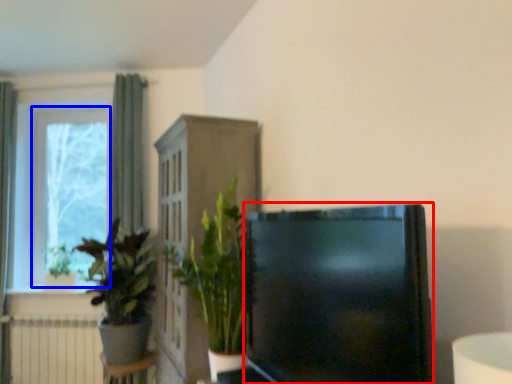
Question: Which object appears farthest to the camera in this image, television (highlighted by a red box) or window frame (highlighted by a blue box)?

Choices:
 (A) television
 (B) window frame

Answer: (B)